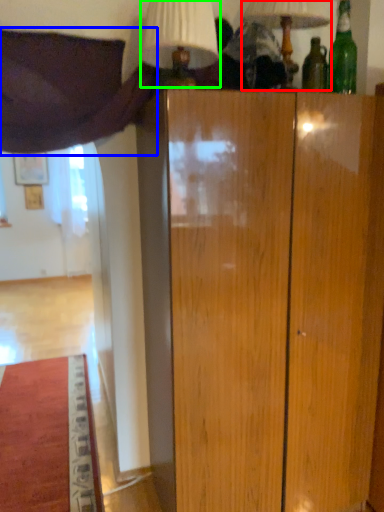
Question: Considering the real-world distances, which object is closest to table lamp (highlighted by a red box)? curtain (highlighted by a blue box) or table lamp (highlighted by a green box).

Choices:
 (A) curtain
 (B) table lamp

Answer: (B)